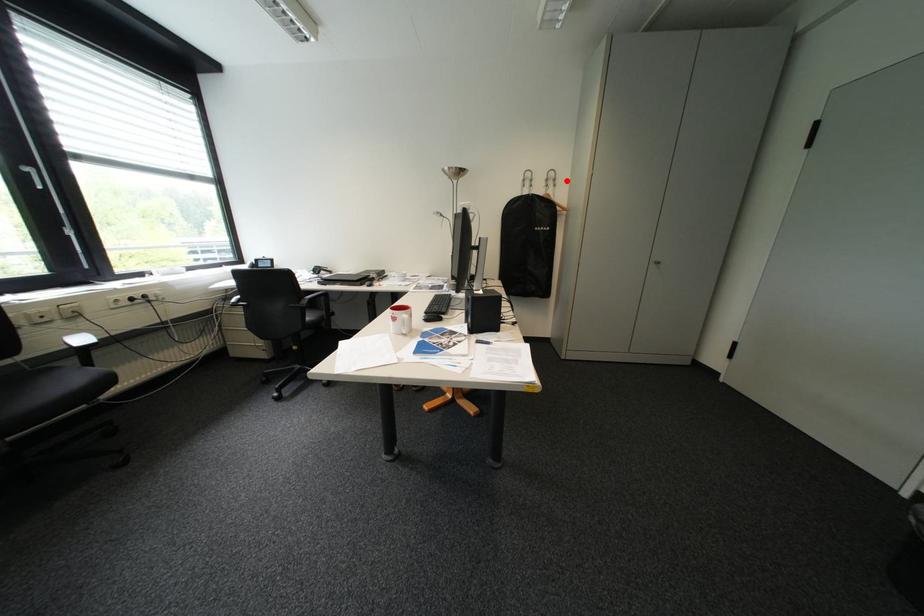
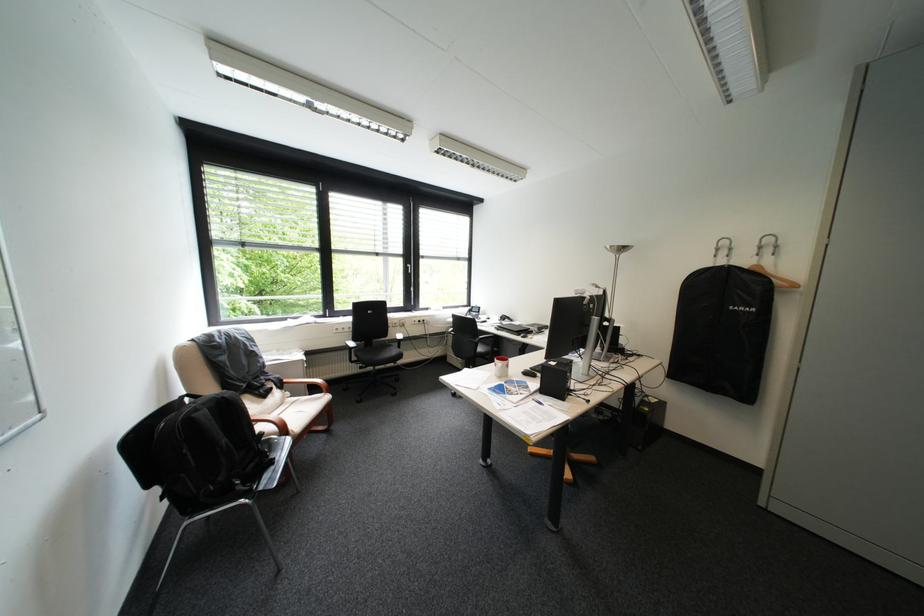
In the second image, find the point that corresponds to the highlighted location in the first image.

(788, 246)